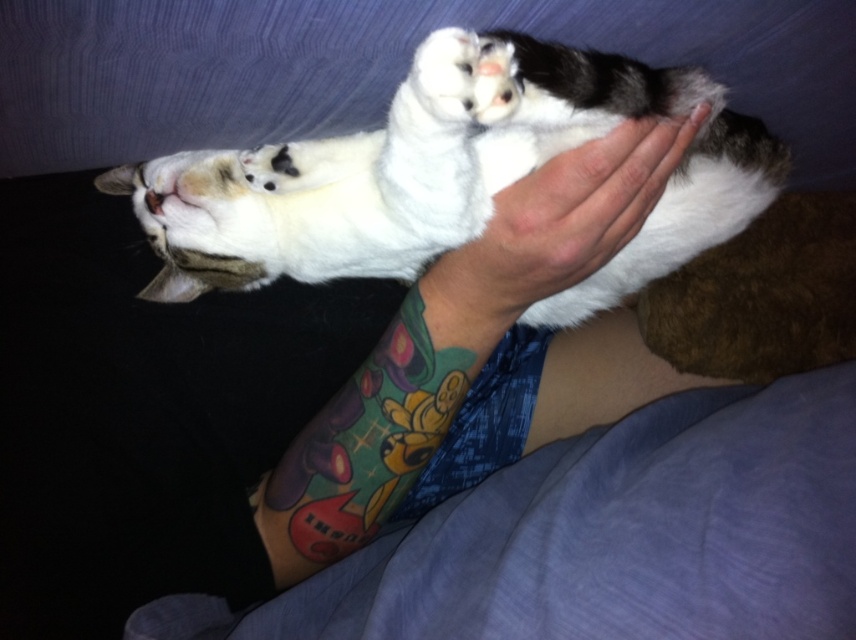
You are a photographer trying to capture the cat in the image. Since the white soft fur cat at center and the smooth skin hand at center are both in focus, which one appears nearer to the camera lens?

The white soft fur cat at center appears nearer to the camera lens because it is closer to the viewer than the smooth skin hand at center.

You are a photographer taking a close up photo of the scene. You want to focus on the white soft fur cat at center and the multicolored tattooed arm at center. Which object should you adjust your focus to first if you want to ensure both are in focus?

The white soft fur cat at center is closer to the viewer than the multicolored tattooed arm at center. To ensure both are in focus, you should focus on the closer object first, which is the white soft fur cat at center.

You are a photographer trying to capture the cat in the image. Since the cat is lying on its back with its legs stretched out, you need to ensure both the multicolored tattooed arm at center and the smooth skin hand at center are visible in the frame. Which object should you focus on to ensure both are in the shot?

The multicolored tattooed arm at center is bigger than the smooth skin hand at center, so focusing on the multicolored tattooed arm at center will ensure both are visible in the frame.